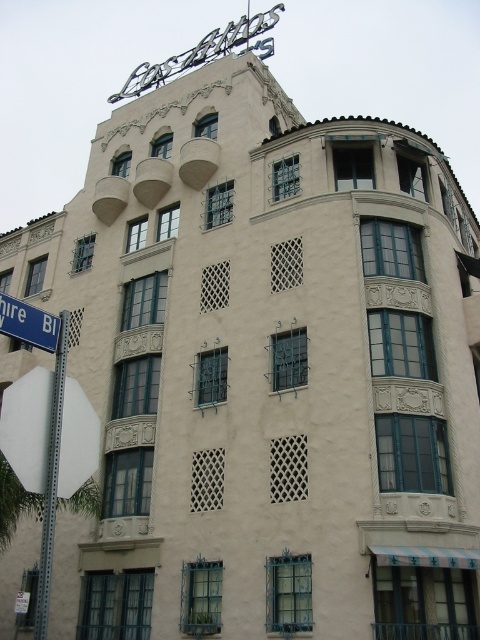
Question: Where is metallic pole at left located in relation to blue plastic street sign at left in the image?

Choices:
 (A) left
 (B) right

Answer: (A)

Question: Which point appears farthest from the camera in this image?

Choices:
 (A) (49, 492)
 (B) (35, 312)

Answer: (B)

Question: Can you confirm if metallic pole at left is positioned to the right of blue plastic street sign at left?

Choices:
 (A) no
 (B) yes

Answer: (A)

Question: Is metallic pole at left positioned behind blue plastic street sign at left?

Choices:
 (A) yes
 (B) no

Answer: (B)

Question: Which point appears closest to the camera in this image?

Choices:
 (A) (57, 451)
 (B) (9, 333)

Answer: (B)